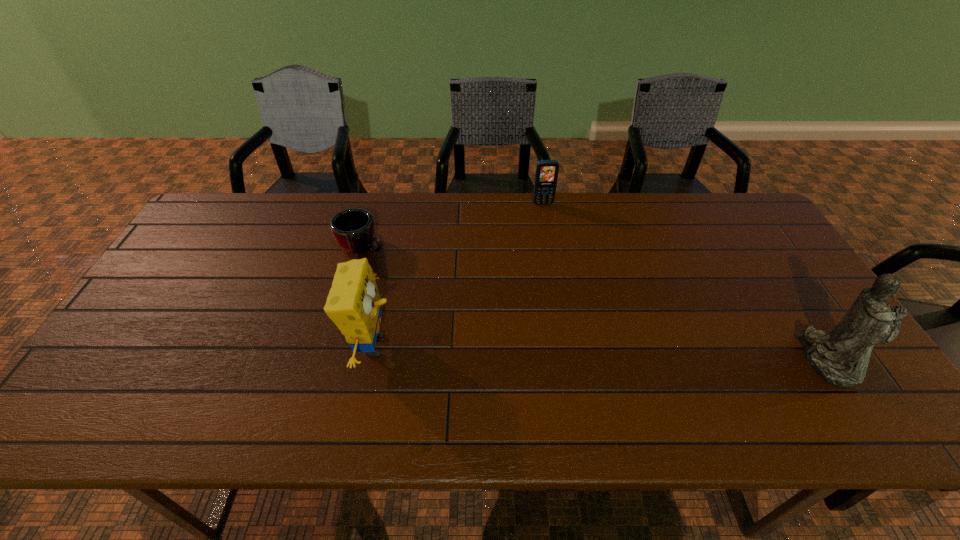
What are the coordinates of `free space on the desktop that is between the second tallest object and the figurine and is positioned on the side of the second farthest object with the handle` in the screenshot? It's located at (563, 352).

Find the location of a particular element. free space on the desktop that is between the sponge and the rightmost object and is positioned on the screen of the third object from left to right is located at coordinates (583, 352).